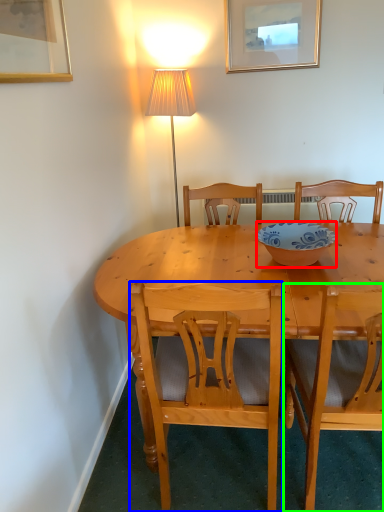
Question: Based on their relative distances, which object is nearer to bowl (highlighted by a red box)? Choose from chair (highlighted by a blue box) and chair (highlighted by a green box).

Choices:
 (A) chair
 (B) chair

Answer: (B)